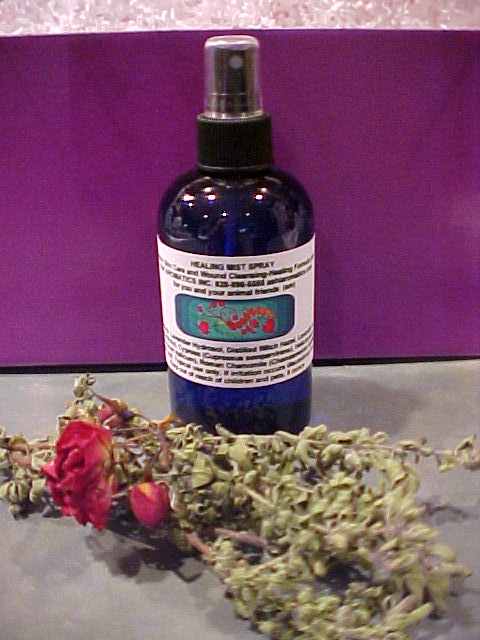
Where is `blue spray bottle`? This screenshot has height=640, width=480. blue spray bottle is located at coordinates (237, 211).